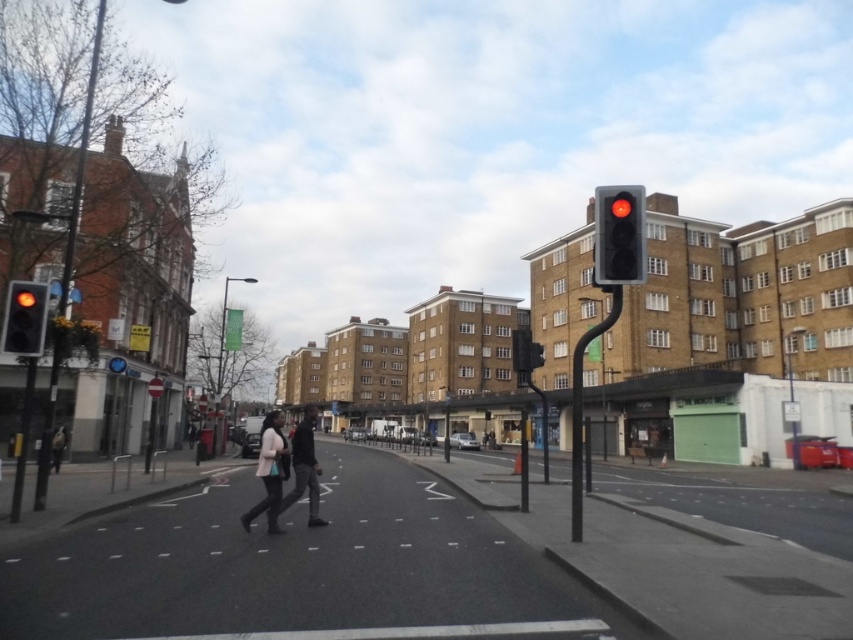
Question: Does red glass traffic light at upper right appear on the right side of matte black jacket at center?

Choices:
 (A) no
 (B) yes

Answer: (B)

Question: Which point is closer to the camera?

Choices:
 (A) matte black traffic light at left
 (B) dark blue jacket at lower left
 (C) matte black jacket at center

Answer: (C)

Question: Does red glass traffic light at upper right have a smaller size compared to dark blue jacket at lower left?

Choices:
 (A) no
 (B) yes

Answer: (A)

Question: Which of the following is the closest to the observer?

Choices:
 (A) dark blue jacket at lower left
 (B) matte black jacket at center
 (C) matte black traffic light at left
 (D) red glass traffic light at upper right

Answer: (D)

Question: Is dark gray fabric jacket at center to the right of dark blue jacket at lower left from the viewer's perspective?

Choices:
 (A) yes
 (B) no

Answer: (B)

Question: Which point is closer to the camera?

Choices:
 (A) (247, 518)
 (B) (42, 308)
 (C) (54, 444)
 (D) (306, 468)

Answer: (A)